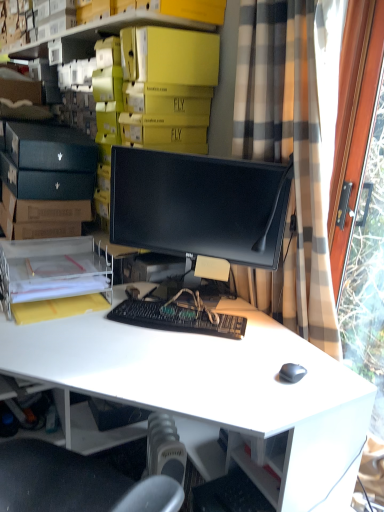
Where is `free space above black matte keyboard at center (from a real-world perspective)`? Image resolution: width=384 pixels, height=512 pixels. free space above black matte keyboard at center (from a real-world perspective) is located at coordinates (175, 313).